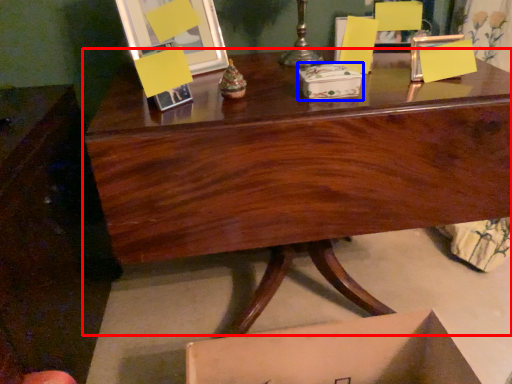
Question: Which point is closer to the camera, desk (highlighted by a red box) or storage box (highlighted by a blue box)?

Choices:
 (A) desk
 (B) storage box

Answer: (A)